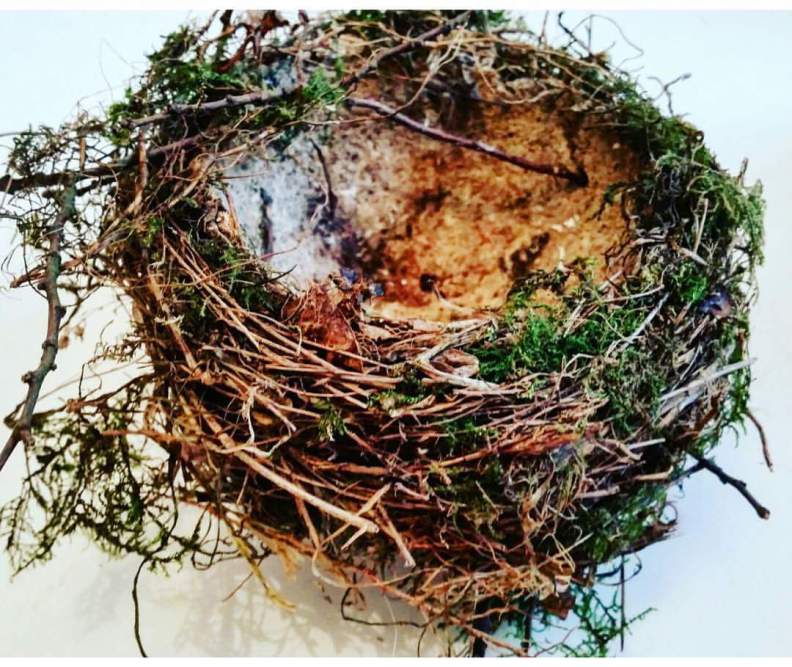
Locate an element on the screen. table is located at coordinates (702, 614).